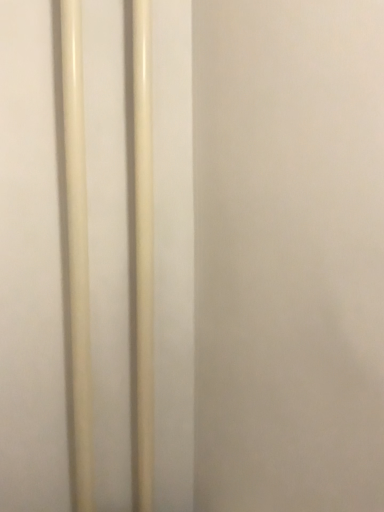
Question: Considering the positions of point (147, 7) and point (76, 374), is point (147, 7) closer or farther from the camera than point (76, 374)?

Choices:
 (A) closer
 (B) farther

Answer: (B)

Question: From the image's perspective, relative to matte white pole at left, the 2th pole from the right, is matte plastic pole at center, arranged as the 2th pole when viewed from the left, above or below?

Choices:
 (A) above
 (B) below

Answer: (A)

Question: Considering the positions of matte plastic pole at center, arranged as the 2th pole when viewed from the left, and matte white pole at left, the 2th pole from the right, in the image, is matte plastic pole at center, arranged as the 2th pole when viewed from the left, wider or thinner than matte white pole at left, the 2th pole from the right,?

Choices:
 (A) thin
 (B) wide

Answer: (A)

Question: In terms of width, does matte white pole at left, acting as the first pole starting from the left, look wider or thinner when compared to matte plastic pole at center, arranged as the 2th pole when viewed from the left?

Choices:
 (A) wide
 (B) thin

Answer: (A)

Question: Is point coord(82,192) closer or farther from the camera than point coord(144,136)?

Choices:
 (A) farther
 (B) closer

Answer: (B)

Question: Visually, is matte white pole at left, the 2th pole from the right, positioned to the left or to the right of matte plastic pole at center, which appears as the 1th pole when viewed from the right?

Choices:
 (A) left
 (B) right

Answer: (A)

Question: From the image's perspective, is matte white pole at left, the 2th pole from the right, positioned above or below matte plastic pole at center, which appears as the 1th pole when viewed from the right?

Choices:
 (A) above
 (B) below

Answer: (B)